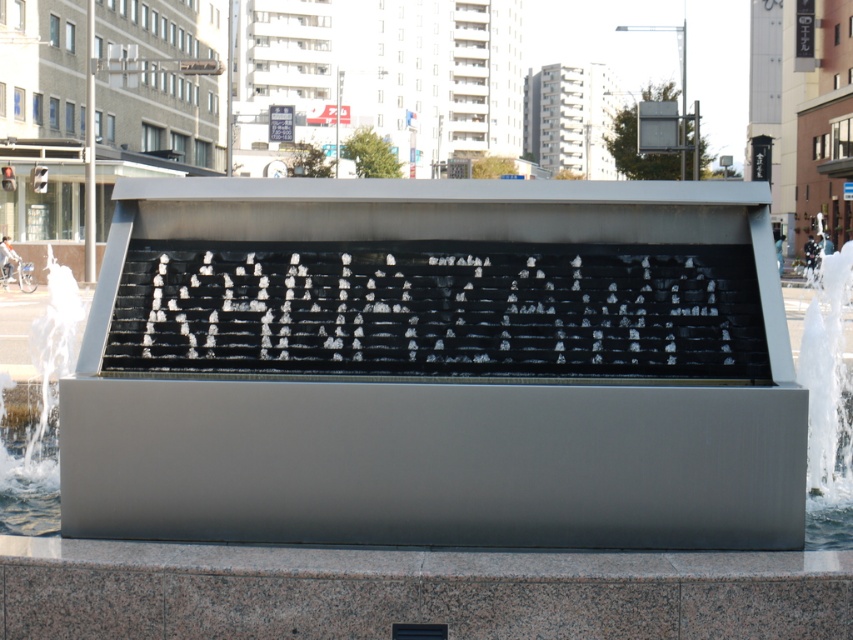
You are a city planner reviewing this urban design. The city has a new regulation requiring all water features to have a safety barrier around them. The barrier must be placed at least 2 meters away from the edge of the fountain. Given the current layout, can the barrier be placed around the satin silver fountain at center without encroaching on the clear water at fountain left?

The satin silver fountain at center is located below clear water at fountain left, meaning the water is above the fountain. Since the barrier needs to be placed around the fountain itself, the clear water at fountain left is part of the fountain structure. Therefore, the barrier can be placed 2 meters away from the fountain edge without affecting the water area.

From the picture: You are a city planner reviewing this urban design. The satin silver fountain at center and the clear water at fountain left are part of a new public space. Which object occupies a larger area in the image?

The clear water at fountain left occupies a larger area than the satin silver fountain at center, as stated in the description.